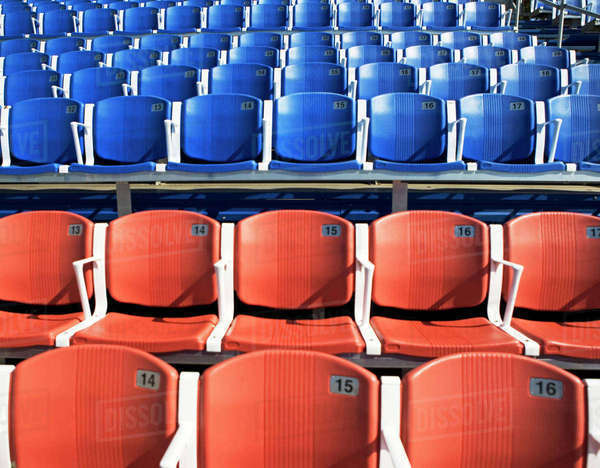
This screenshot has height=468, width=600. Find the location of `red seat bottoms`. red seat bottoms is located at coordinates (23, 324), (140, 326), (286, 326), (443, 335), (559, 333).